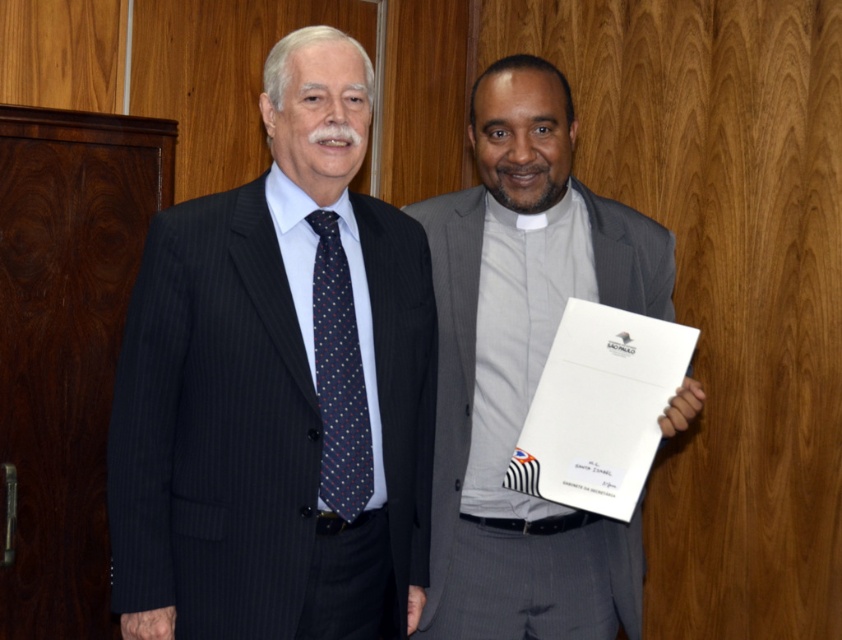
In the scene shown: You are a photographer setting up for a formal event. You need to ensure that the matte black suit at left and the dark blue silk tie at left are visible in your shot. Based on their positions, which one would appear higher in the frame?

The matte black suit at left is above the dark blue silk tie at left, so the matte black suit at left would appear higher in the frame.

You are a photographer setting up for a formal event. You need to ensure that the gray matte suit at center and the dark blue silk tie at left are both visible in the frame. Based on their positions, which one should you focus on first to ensure proper composition?

The gray matte suit at center is located above the dark blue silk tie at left, so you should focus on the gray matte suit at center first to ensure proper composition.